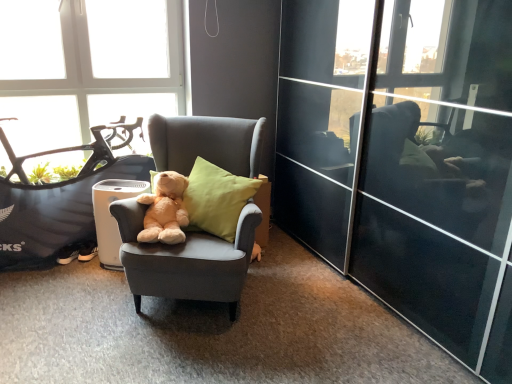
I want to click on vacant area that lies to the right of matte gray armchair at center, so click(320, 316).